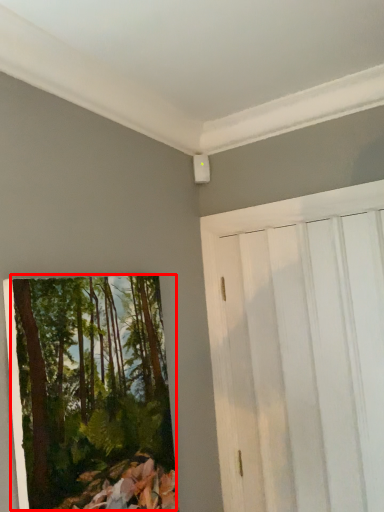
Question: Considering the relative positions of tree (annotated by the red box) and barn door in the image provided, where is tree (annotated by the red box) located with respect to the staircase?

Choices:
 (A) right
 (B) left

Answer: (B)